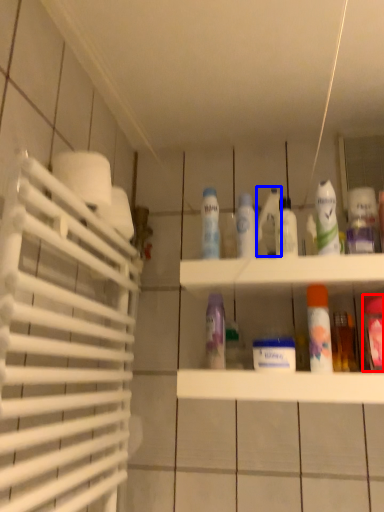
Question: Among these objects, which one is farthest to the camera, mouthwash (highlighted by a red box) or cleaning product (highlighted by a blue box)?

Choices:
 (A) mouthwash
 (B) cleaning product

Answer: (B)